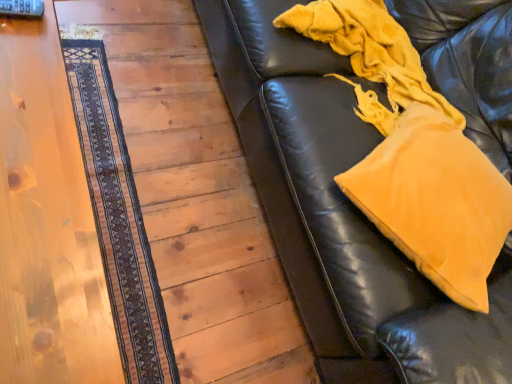
Image resolution: width=512 pixels, height=384 pixels. What do you see at coordinates (47, 222) in the screenshot?
I see `wooden table at left` at bounding box center [47, 222].

The width and height of the screenshot is (512, 384). Identify the location of velvety yellow blanket at right. (371, 55).

What do you see at coordinates (371, 55) in the screenshot? The width and height of the screenshot is (512, 384). I see `velvety yellow blanket at right` at bounding box center [371, 55].

Measure the distance between wooden floor at lower left and camera.

wooden floor at lower left is 1.20 meters from camera.

The image size is (512, 384). Identify the location of wooden table at left. (47, 222).

Considering the relative positions of dark brown woven mat at left and mustard yellow fabric pillow at upper right in the image provided, is dark brown woven mat at left behind mustard yellow fabric pillow at upper right?

Yes, dark brown woven mat at left is further from the camera.

Which is behind, point (129, 363) or point (499, 183)?

Point (499, 183)

Between dark brown woven mat at left and mustard yellow fabric pillow at upper right, which one appears on the left side from the viewer's perspective?

dark brown woven mat at left.

Which is closer to the camera, (151, 308) or (310, 19)?

The point (151, 308) is more forward.

Is the depth of dark brown woven mat at left greater than that of velvety yellow blanket at right?

Yes, dark brown woven mat at left is behind velvety yellow blanket at right.

Can you confirm if dark brown woven mat at left is shorter than velvety yellow blanket at right?

Correct, dark brown woven mat at left is not as tall as velvety yellow blanket at right.

Is the surface of dark brown woven mat at left in direct contact with velvety yellow blanket at right?

No, dark brown woven mat at left is not touching velvety yellow blanket at right.

Is wooden floor at lower left spatially inside dark brown woven mat at left, or outside of it?

wooden floor at lower left exists outside the volume of dark brown woven mat at left.

Measure the distance from wooden floor at lower left to dark brown woven mat at left.

A distance of 6.24 inches exists between wooden floor at lower left and dark brown woven mat at left.

Is wooden floor at lower left shorter than dark brown woven mat at left?

No.

Is point (184, 141) more distant than point (125, 251)?

Yes, it is behind point (125, 251).

From the image's perspective, which one is positioned higher, mustard yellow fabric pillow at upper right or velvety yellow blanket at right?

velvety yellow blanket at right appears higher in the image.

Is mustard yellow fabric pillow at upper right positioned with its back to velvety yellow blanket at right?

That's not correct — mustard yellow fabric pillow at upper right is not looking away from velvety yellow blanket at right.

In terms of height, does mustard yellow fabric pillow at upper right look taller or shorter compared to velvety yellow blanket at right?

Clearly, mustard yellow fabric pillow at upper right is shorter compared to velvety yellow blanket at right.

Find the location of `table located above the dark brown woven mat at left (from a real-world perspective)`. table located above the dark brown woven mat at left (from a real-world perspective) is located at coordinates (47, 222).

Are dark brown woven mat at left and wooden table at left beside each other?

No, dark brown woven mat at left is not touching wooden table at left.

Measure the distance between dark brown woven mat at left and wooden table at left.

dark brown woven mat at left and wooden table at left are 19.14 inches apart.

Consider the image. Considering the positions of objects dark brown woven mat at left and wooden table at left in the image provided, who is more to the right, dark brown woven mat at left or wooden table at left?

dark brown woven mat at left is more to the right.

In the image, is dark brown woven mat at left on the left side or the right side of wooden floor at lower left?

From the image, it's evident that dark brown woven mat at left is to the left of wooden floor at lower left.

Could you tell me if dark brown woven mat at left is facing wooden floor at lower left?

Yes, dark brown woven mat at left is oriented towards wooden floor at lower left.

Looking at this image, can you confirm if dark brown woven mat at left is thinner than wooden floor at lower left?

Correct, the width of dark brown woven mat at left is less than that of wooden floor at lower left.

What's the angular difference between dark brown woven mat at left and wooden floor at lower left's facing directions?

The angle between the facing direction of dark brown woven mat at left and the facing direction of wooden floor at lower left is 178 degrees.

Which of these two, mustard yellow fabric pillow at upper right or dark brown woven mat at left, is wider?

mustard yellow fabric pillow at upper right.

From the image's perspective, does mustard yellow fabric pillow at upper right appear higher than dark brown woven mat at left?

Actually, mustard yellow fabric pillow at upper right appears below dark brown woven mat at left in the image.

How far apart are mustard yellow fabric pillow at upper right and dark brown woven mat at left?

The distance of mustard yellow fabric pillow at upper right from dark brown woven mat at left is 32.18 inches.

At what (x,y) coordinates should I click in order to perform the action: click on throw pillow located above the dark brown woven mat at left (from a real-world perspective). Please return your answer as a coordinate pair (x, y). Image resolution: width=512 pixels, height=384 pixels. Looking at the image, I should click on (436, 202).

I want to click on blanket on the right of dark brown woven mat at left, so click(371, 55).

When comparing their distances from wooden table at left, does wooden floor at lower left or mustard yellow fabric pillow at upper right seem closer?

wooden floor at lower left lies closer to wooden table at left than the other object.

When comparing their distances from dark brown woven mat at left, does velvety yellow blanket at right or mustard yellow fabric pillow at upper right seem closer?

Among the two, velvety yellow blanket at right is located nearer to dark brown woven mat at left.

When comparing their distances from velvety yellow blanket at right, does wooden table at left or mustard yellow fabric pillow at upper right seem further?

wooden table at left is further to velvety yellow blanket at right.

Which object lies further to the anchor point velvety yellow blanket at right, wooden table at left or wooden floor at lower left?

wooden table at left is further to velvety yellow blanket at right.

Based on their spatial positions, is dark brown woven mat at left or wooden floor at lower left closer to mustard yellow fabric pillow at upper right?

wooden floor at lower left is closer to mustard yellow fabric pillow at upper right.

Looking at the image, which one is located closer to mustard yellow fabric pillow at upper right, wooden table at left or velvety yellow blanket at right?

velvety yellow blanket at right lies closer to mustard yellow fabric pillow at upper right than the other object.

Considering their positions, is velvety yellow blanket at right positioned further to wooden table at left than mustard yellow fabric pillow at upper right?

The object further to wooden table at left is velvety yellow blanket at right.

From the picture: Which object lies further to the anchor point mustard yellow fabric pillow at upper right, velvety yellow blanket at right or wooden floor at lower left?

The object further to mustard yellow fabric pillow at upper right is wooden floor at lower left.

The height and width of the screenshot is (384, 512). What are the coordinates of `panel between dark brown woven mat at left and velvety yellow blanket at right from left to right` in the screenshot? It's located at (195, 197).

Locate an element on the screen. The width and height of the screenshot is (512, 384). panel between wooden table at left and dark brown woven mat at left along the z-axis is located at coordinates (195, 197).

You are a GUI agent. You are given a task and a screenshot of the screen. Output one action in this format:
    pyautogui.click(x=<x>, y=<y>)
    Task: Click on the blanket situated between dark brown woven mat at left and mustard yellow fabric pillow at upper right from left to right
    
    Given the screenshot: What is the action you would take?
    pyautogui.click(x=371, y=55)

In order to click on blanket between wooden table at left and mustard yellow fabric pillow at upper right from left to right in this screenshot , I will do `click(371, 55)`.